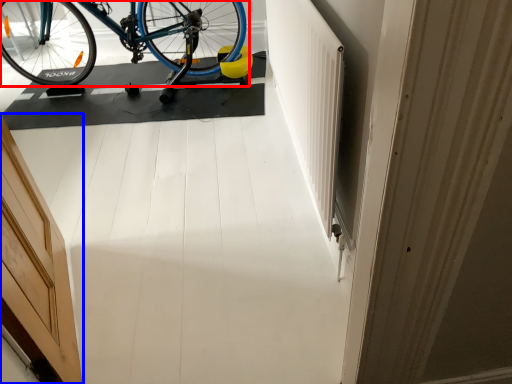
Question: Which point is closer to the camera, bicycle (highlighted by a red box) or door (highlighted by a blue box)?

Choices:
 (A) bicycle
 (B) door

Answer: (B)